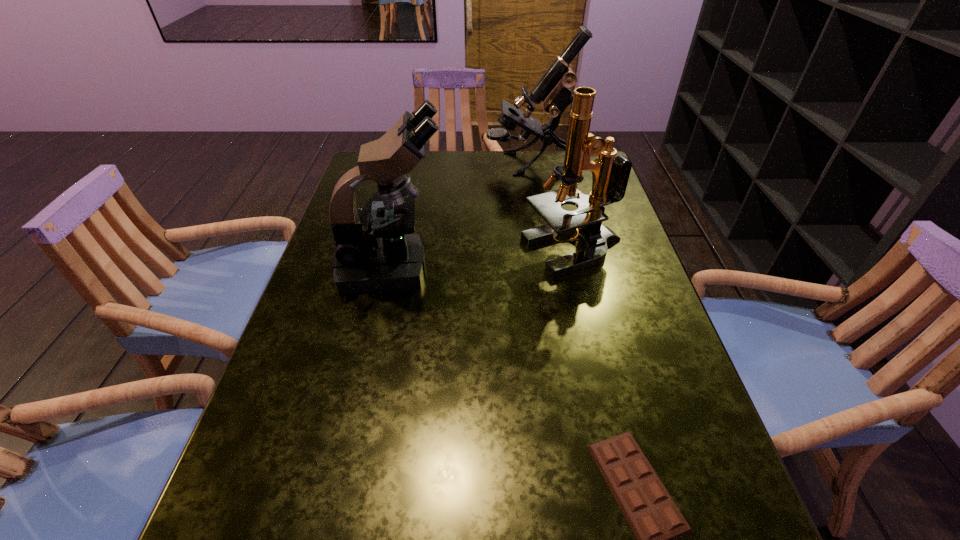
You are a GUI agent. You are given a task and a screenshot of the screen. Output one action in this format:
    pyautogui.click(x=<x>, y=<y>)
    Task: Click on the farthest object
    The height and width of the screenshot is (540, 960).
    Given the screenshot: What is the action you would take?
    pyautogui.click(x=553, y=90)

This screenshot has height=540, width=960. I want to click on the leftmost microscope, so click(375, 250).

The image size is (960, 540). I want to click on free spot located through the eyepiece of the farthest microscope, so click(468, 163).

Identify the location of vacant space located 0.060m through the eyepiece of the farthest microscope. The image size is (960, 540). (468, 163).

At what (x,y) coordinates should I click in order to perform the action: click on vacant space located 0.220m through the eyepiece of the farthest microscope. Please return your answer as a coordinate pair (x, y). The height and width of the screenshot is (540, 960). Looking at the image, I should click on (418, 163).

Where is `vacant space situated on the front of the leftmost object`? vacant space situated on the front of the leftmost object is located at coordinates (374, 350).

Identify the location of object at the far edge. (553, 90).

You are a GUI agent. You are given a task and a screenshot of the screen. Output one action in this format:
    pyautogui.click(x=<x>, y=<y>)
    Task: Click on the object present at the left edge
    
    Given the screenshot: What is the action you would take?
    pyautogui.click(x=375, y=250)

Locate an element on the screen. object positioned at the far right corner is located at coordinates 553,90.

Where is `vacant space at the far edge of the desktop`? The height and width of the screenshot is (540, 960). vacant space at the far edge of the desktop is located at coordinates (452, 174).